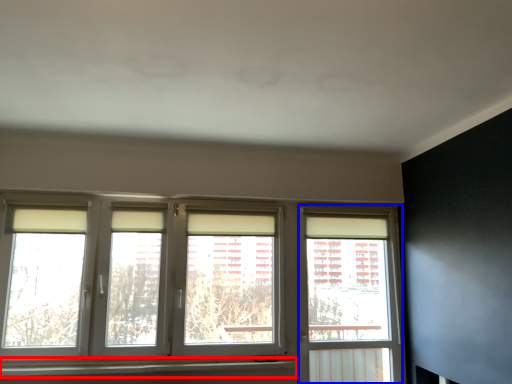
Question: Which object appears farthest to the camera in this image, window sill (highlighted by a red box) or window frame (highlighted by a blue box)?

Choices:
 (A) window sill
 (B) window frame

Answer: (B)